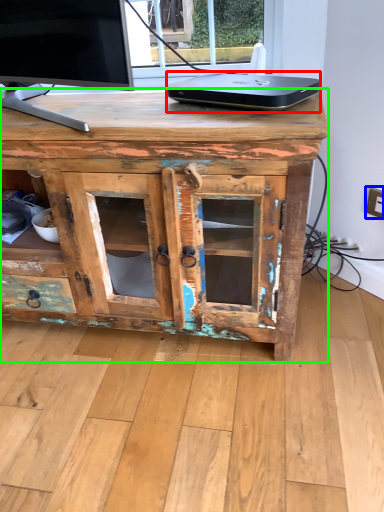
Question: Based on their relative distances, which object is farther from laptop (highlighted by a red box)? Choose from electric outlet (highlighted by a blue box) and desk (highlighted by a green box).

Choices:
 (A) electric outlet
 (B) desk

Answer: (A)